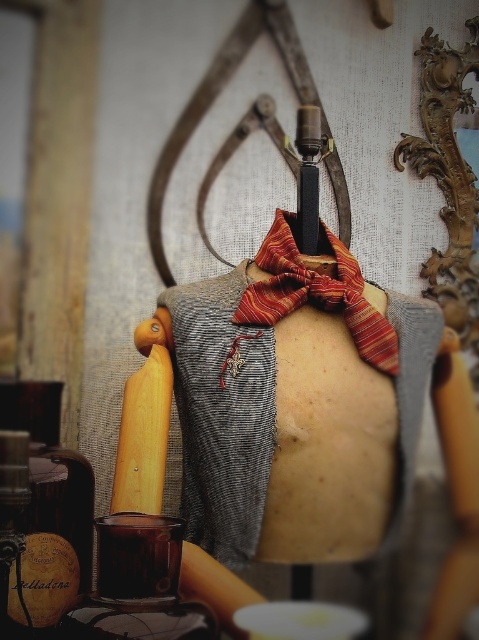
Which of these two, striped silk bow at center or wooden rolling pin at left, stands taller?

wooden rolling pin at left

Consider the image. Does striped silk bow at center have a smaller size compared to wooden rolling pin at left?

Actually, striped silk bow at center might be larger than wooden rolling pin at left.

This screenshot has width=479, height=640. I want to click on striped silk bow at center, so click(316, 292).